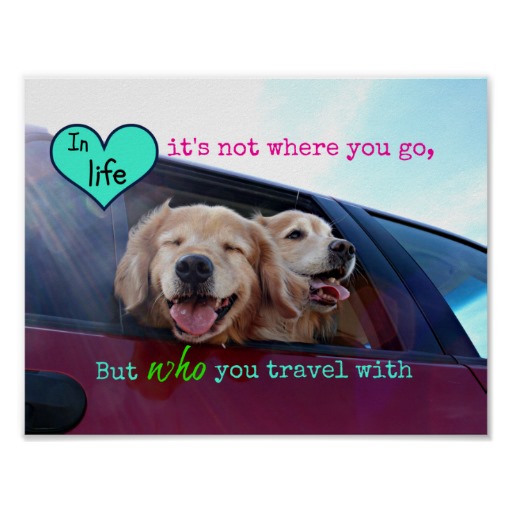
Find the location of a particular element. Image resolution: width=512 pixels, height=512 pixels. window is located at coordinates (471, 298).